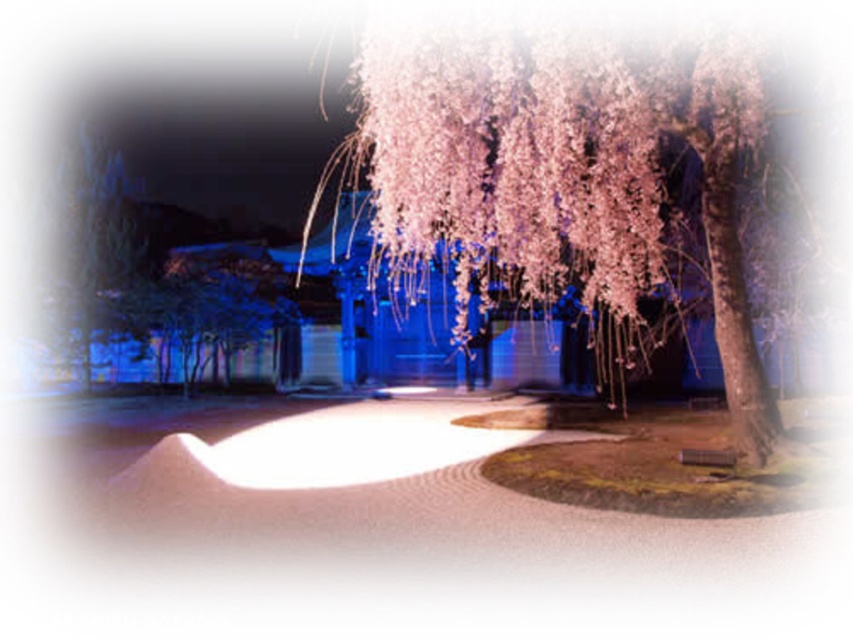
Between pink blossoms at center and smooth gray stone wall at left, which one appears on the right side from the viewer's perspective?

From the viewer's perspective, pink blossoms at center appears more on the right side.

Does pink blossoms at center come behind smooth gray stone wall at left?

That is False.

Which is in front, point (413, 56) or point (129, 328)?

Point (413, 56) is more forward.

Where is `pink blossoms at center`? This screenshot has width=853, height=640. pink blossoms at center is located at coordinates (558, 168).